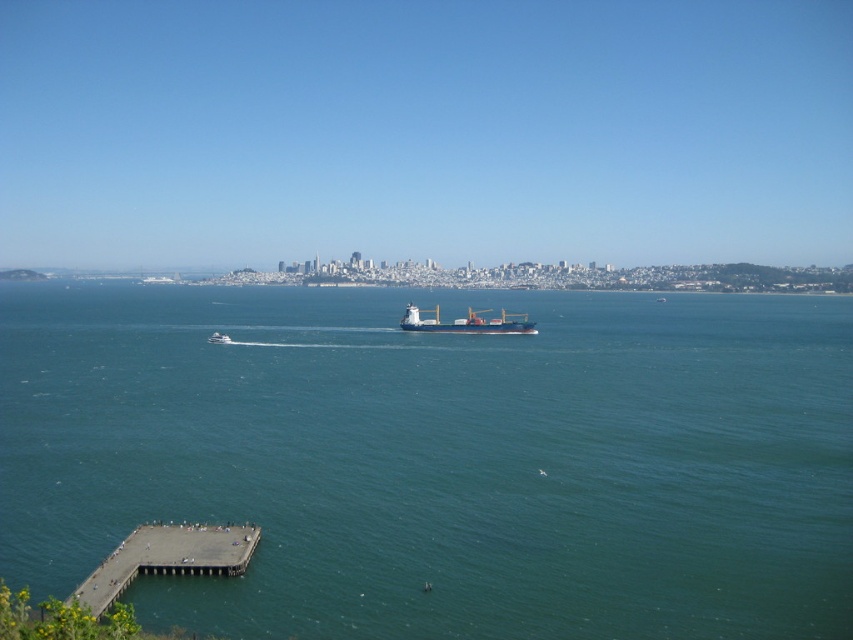
Can you confirm if concrete pier at lower left is positioned below white matte cargo ship at center?

Yes.

Which is below, concrete pier at lower left or white matte cargo ship at center?

concrete pier at lower left is lower down.

Locate an element on the screen. concrete pier at lower left is located at coordinates (167, 557).

Locate an element on the screen. concrete pier at lower left is located at coordinates (167, 557).

Does point (497, 333) lie behind point (221, 337)?

Yes, it is behind point (221, 337).

Is white matte cargo ship at center to the left of white glossy boat at center from the viewer's perspective?

No, white matte cargo ship at center is not to the left of white glossy boat at center.

Which is behind, point (469, 321) or point (230, 342)?

Positioned behind is point (469, 321).

Where is `white matte cargo ship at center`? white matte cargo ship at center is located at coordinates (467, 323).

Is blue water at center in front of white matte cargo ship at center?

Yes.

Does blue water at center have a smaller size compared to white matte cargo ship at center?

Incorrect, blue water at center is not smaller in size than white matte cargo ship at center.

Which is behind, point (631, 602) or point (404, 324)?

Point (404, 324)

Locate an element on the screen. This screenshot has width=853, height=640. blue water at center is located at coordinates [439, 460].